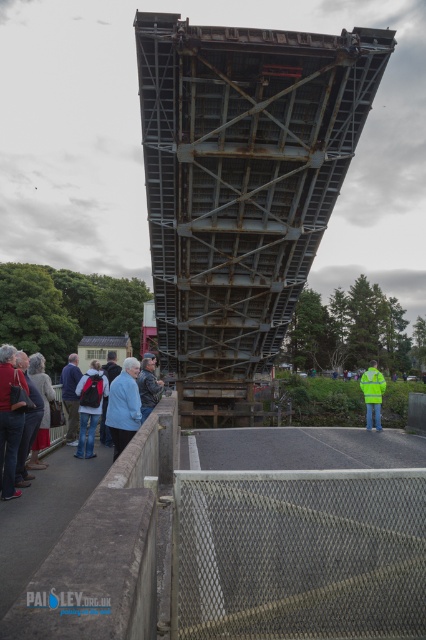
Can you confirm if matte black backpack at center is positioned to the left of light brown leather jacket at lower left?

In fact, matte black backpack at center is to the right of light brown leather jacket at lower left.

Who is more forward, (80, 440) or (43, 424)?

Point (43, 424) is more forward.

I want to click on matte black backpack at center, so click(89, 406).

Locate an element on the screen. Image resolution: width=426 pixels, height=640 pixels. matte black backpack at center is located at coordinates (x=89, y=406).

Does blue fabric jacket at center have a larger size compared to matte black backpack at center?

Correct, blue fabric jacket at center is larger in size than matte black backpack at center.

Is blue fabric jacket at center behind matte black backpack at center?

No, it is not.

What do you see at coordinates (123, 404) in the screenshot? The width and height of the screenshot is (426, 640). I see `blue fabric jacket at center` at bounding box center [123, 404].

This screenshot has width=426, height=640. In order to click on blue fabric jacket at center in this screenshot , I will do `click(123, 404)`.

Does rusty metal bridge at center have a smaller size compared to dark gray fabric jacket at lower left?

No.

Who is more forward, (270, 188) or (25, 474)?

Point (25, 474) is in front.

At what (x,y) coordinates should I click in order to perform the action: click on rusty metal bridge at center. Please return your answer as a coordinate pair (x, y). The width and height of the screenshot is (426, 640). Looking at the image, I should click on (241, 186).